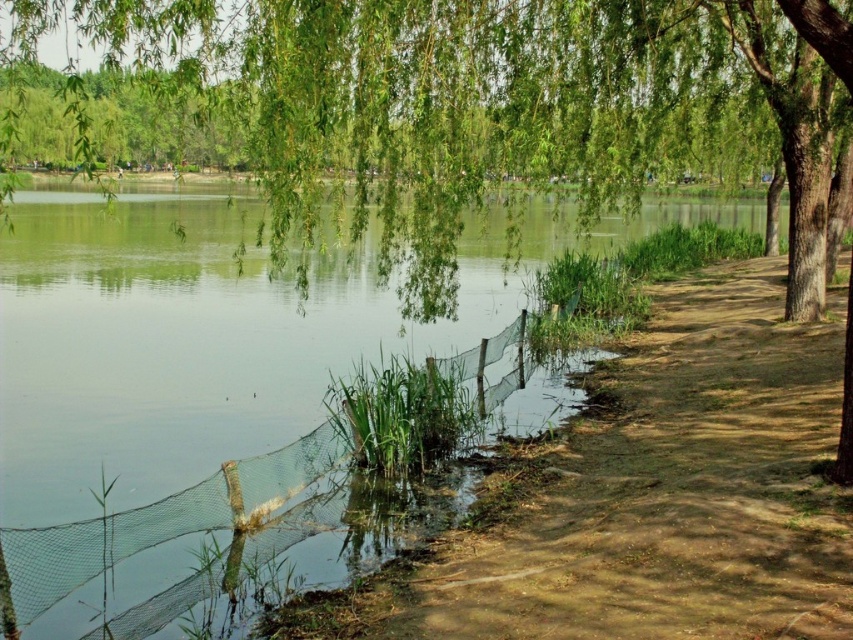
You are a hiker walking along the brown dirt path at lower right. You want to reach the water to take a photo. Is the transparent mesh net at lower center blocking your path?

The brown dirt path at lower right is in front of the transparent mesh net at lower center, so the net is not blocking your path. You can continue along the path towards the water.

You are planning to take a photo of the green leafy willow at upper center and the brown dirt path at lower right. Which object appears wider in the image?

The green leafy willow at upper center appears wider than the brown dirt path at lower right because its width is larger than the path.

You are a park ranger planning to install a new bench along the sandy path. The bench needs to be placed at coordinates point A, which is at position 0.169 on the x and 0.539 on the y. Is the green leafy willow at upper center located at point A?

The green leafy willow at upper center is located at point A, which has coordinates 0.169 on the x and 0.539 on the y. Therefore, the willow is exactly at point A, so placing the bench there would mean it is under the willow.